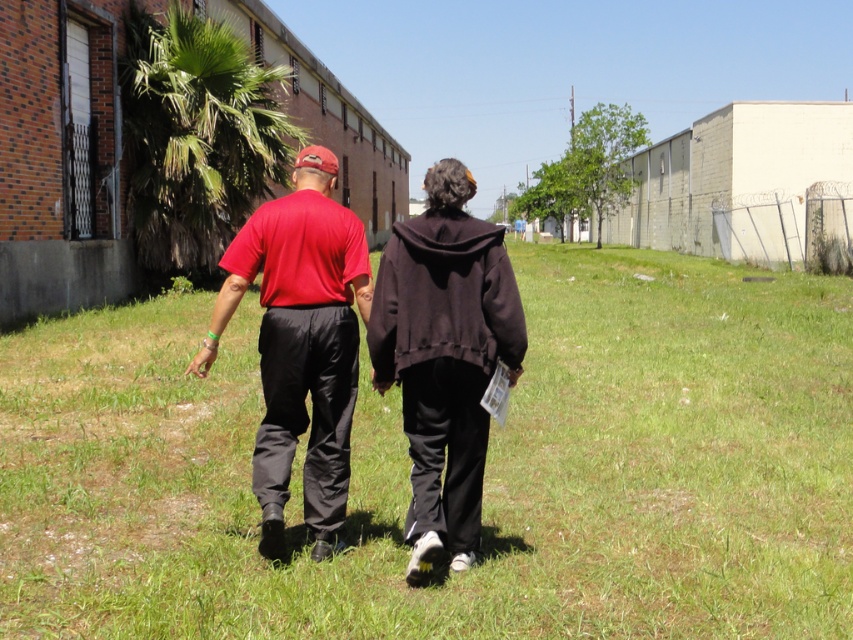
You are a photographer trying to capture a clear shot of the black matte hoodie at center. However, the green grass at center is blocking your view. Can you determine if the grass is taller than the hoodie to know whether you need to adjust your angle?

The green grass at center has a greater height compared to the black matte hoodie at center, so yes, the grass is taller than the hoodie. You will need to adjust your angle to avoid obstruction.

You are a photographer trying to capture a clear shot of the matte red shirt at center while standing on the green grass at center. Considering the height difference between the two, what adjustment should you make to your camera angle?

Since the green grass at center is much taller than the matte red shirt at center, you should lower your camera angle to look upwards to capture the matte red shirt at center clearly through the grass.

You are standing at the camera position and want to walk towards the green grass at center. What direction should you move in?

The green grass at center is located at point coordinates 0.742 on the x axis and 0.569 on the y axis, so you should move towards the center of the image to reach it.